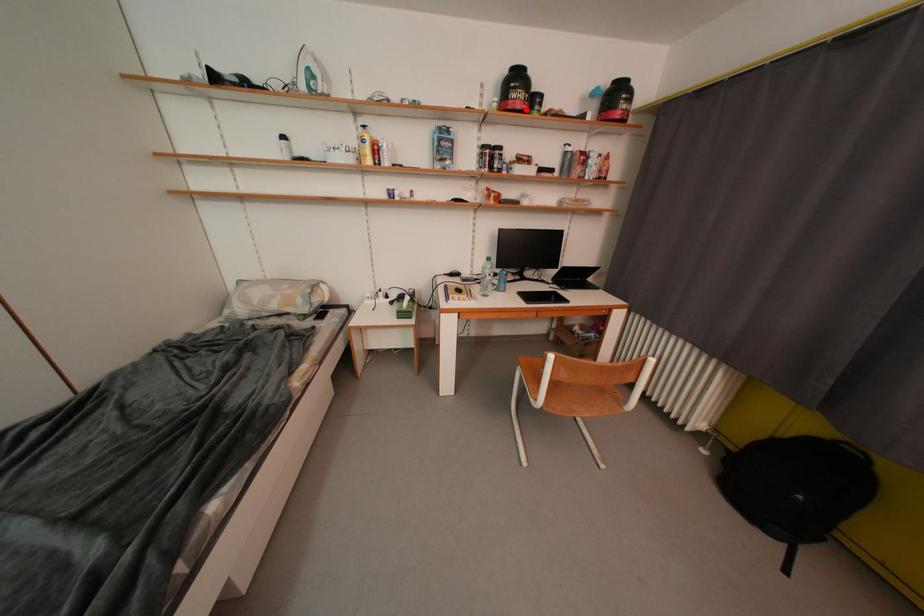
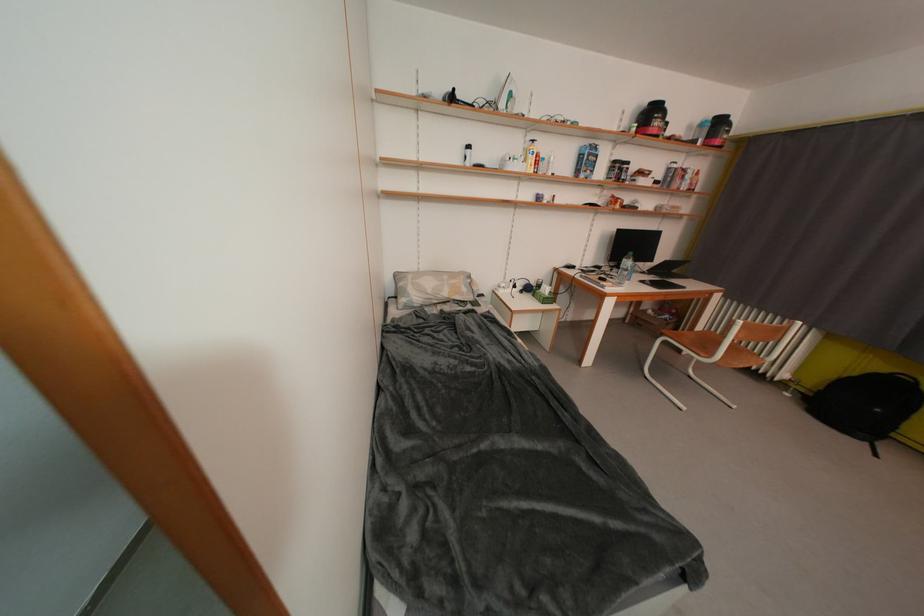
The point at the highlighted location is marked in the first image. Where is the corresponding point in the second image?

(663, 136)